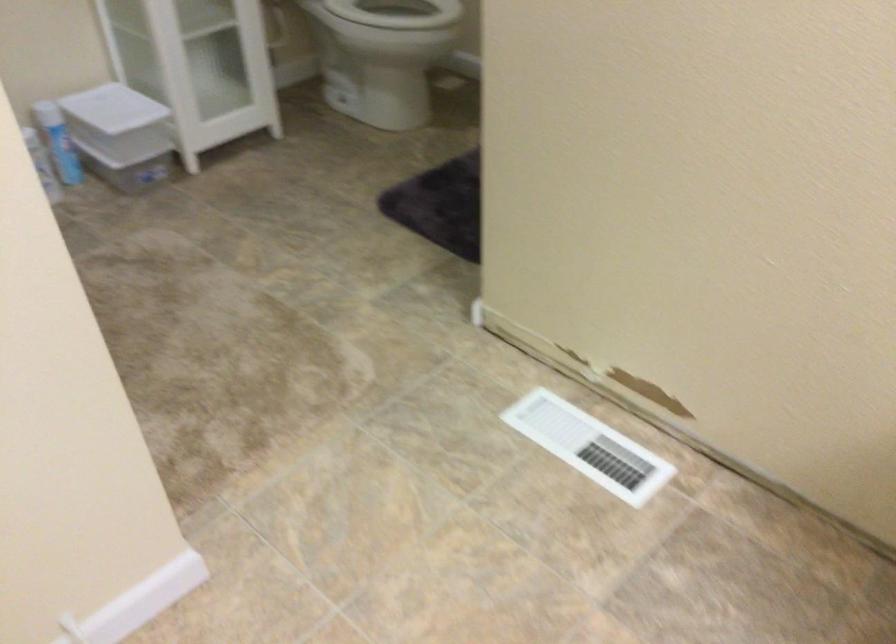
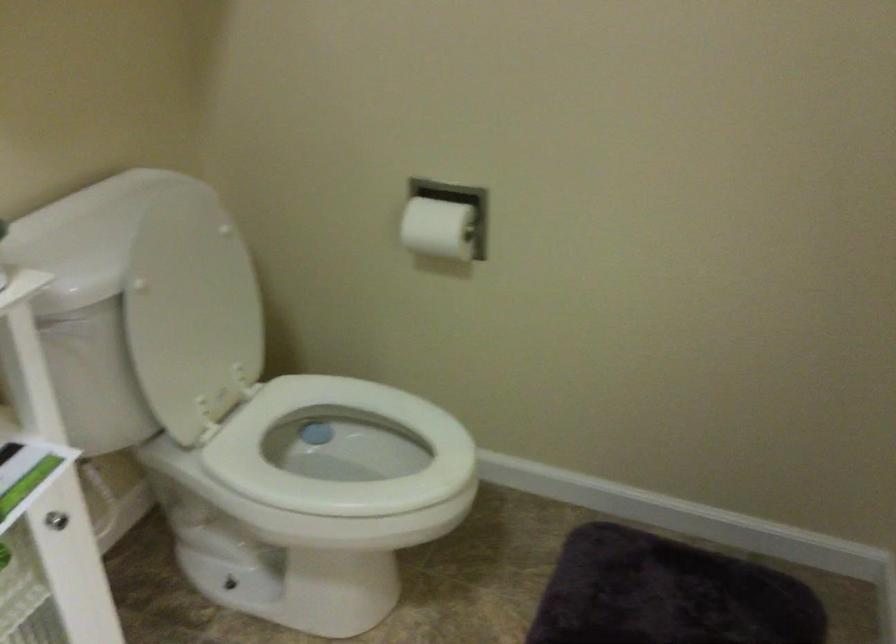
Which direction would the cameraman need to move to produce the second image?

The movement direction of the cameraman is left, forward.